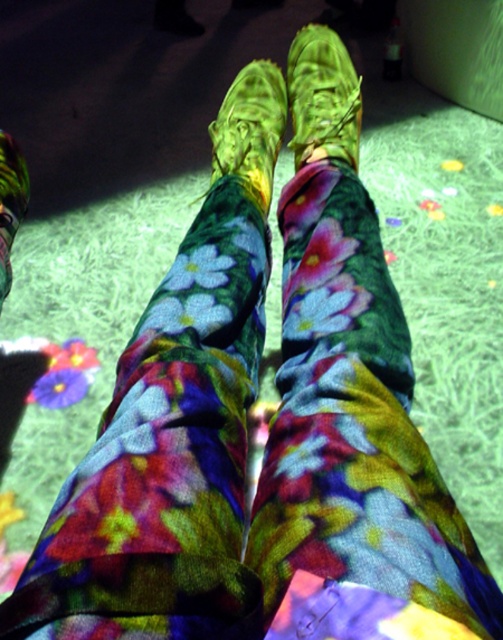
Who is positioned more to the right, green suede boot at center or green suede shoe at center?

green suede boot at center is more to the right.

At what (x,y) coordinates should I click in order to perform the action: click on green suede boot at center. Please return your answer as a coordinate pair (x, y). This screenshot has height=640, width=503. Looking at the image, I should click on (250, 129).

Can you confirm if leather-like green shoe at center is bigger than green suede shoe at center?

Indeed, leather-like green shoe at center has a larger size compared to green suede shoe at center.

Where is `leather-like green shoe at center`? leather-like green shoe at center is located at coordinates tap(322, 97).

Does point (331, 116) come behind point (248, 70)?

No, (331, 116) is closer to viewer.

Measure the distance between leather-like green shoe at center and green suede boot at center.

leather-like green shoe at center and green suede boot at center are 3.57 inches apart.

At what (x,y) coordinates should I click in order to perform the action: click on leather-like green shoe at center. Please return your answer as a coordinate pair (x, y). The image size is (503, 640). Looking at the image, I should click on (322, 97).